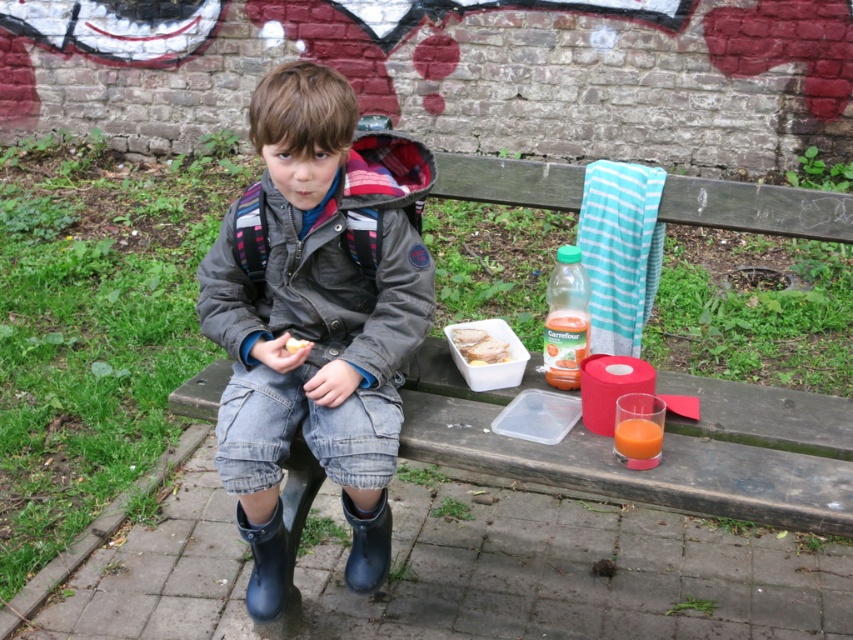
Describe the element at coordinates (619, 250) in the screenshot. This screenshot has height=640, width=853. I see `teal striped towel at upper right` at that location.

Where is `teal striped towel at upper right`? Image resolution: width=853 pixels, height=640 pixels. teal striped towel at upper right is located at coordinates (619, 250).

I want to click on teal striped towel at upper right, so click(x=619, y=250).

Between matte gray jacket at center and teal striped towel at upper right, which one has less height?

teal striped towel at upper right

Does point (325, 268) come farther from viewer compared to point (619, 248)?

No, (325, 268) is closer to viewer.

Where is `matte gray jacket at center`? The height and width of the screenshot is (640, 853). matte gray jacket at center is located at coordinates (312, 310).

Consider the image. Does matte gray jacket at center come in front of white plastic sandwich at center?

Yes, it is.

This screenshot has height=640, width=853. Describe the element at coordinates (312, 310) in the screenshot. I see `matte gray jacket at center` at that location.

Find the location of a particular element. This screenshot has height=640, width=853. matte gray jacket at center is located at coordinates (312, 310).